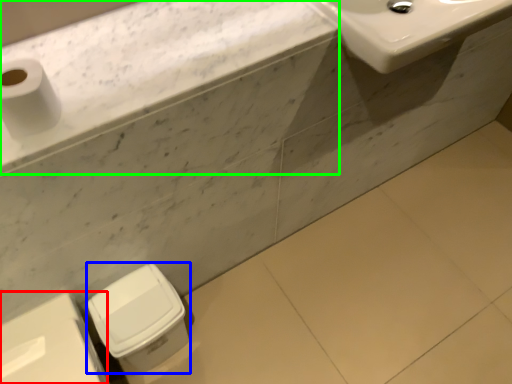
Question: Considering the real-world distances, which object is farthest from porcelain (highlighted by a red box)? porcelain (highlighted by a blue box) or counter top (highlighted by a green box)?

Choices:
 (A) porcelain
 (B) counter top

Answer: (B)